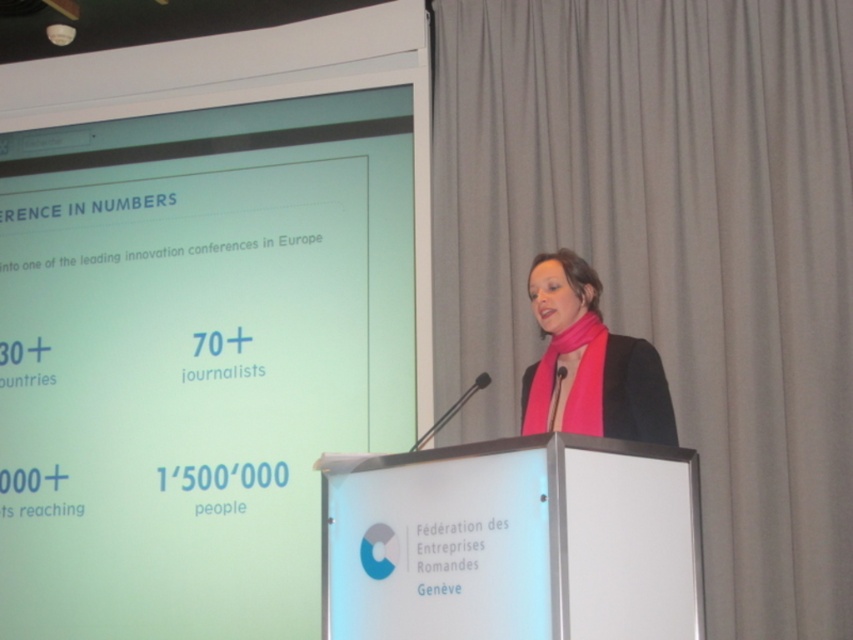
Question: Is matte gray curtain at upper right closer to camera compared to pink fabric scarf at center?

Choices:
 (A) yes
 (B) no

Answer: (B)

Question: Estimate the real-world distances between objects in this image. Which object is farther from the white glossy projection screen at upper left?

Choices:
 (A) pink fabric scarf at center
 (B) matte gray curtain at upper right

Answer: (A)

Question: Is white glossy projection screen at upper left to the left of matte gray curtain at upper right from the viewer's perspective?

Choices:
 (A) no
 (B) yes

Answer: (B)

Question: Does white glossy projection screen at upper left lie in front of matte gray curtain at upper right?

Choices:
 (A) yes
 (B) no

Answer: (B)

Question: Which object is the closest to the white glossy projection screen at upper left?

Choices:
 (A) matte gray curtain at upper right
 (B) pink fabric scarf at center

Answer: (A)

Question: Which of the following is the farthest from the observer?

Choices:
 (A) (329, 93)
 (B) (604, 380)

Answer: (A)